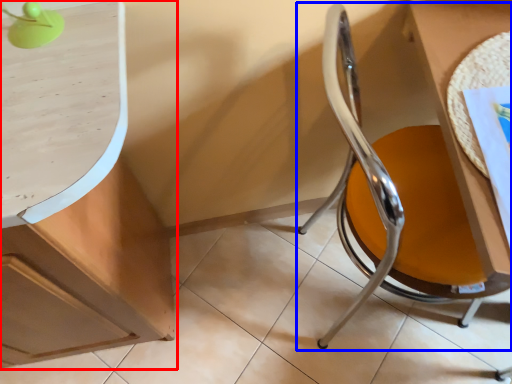
Question: Which object is further to the camera taking this photo, cabinetry (highlighted by a red box) or chair (highlighted by a blue box)?

Choices:
 (A) cabinetry
 (B) chair

Answer: (A)